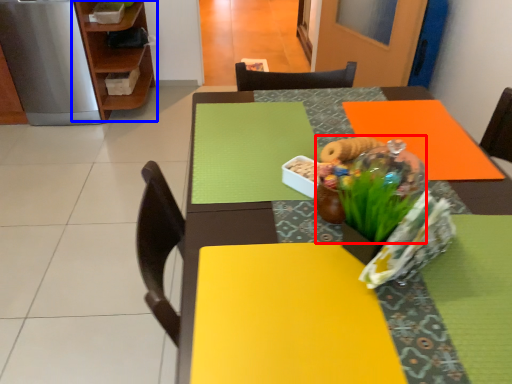
Question: Which object is further to the camera taking this photo, floral arrangement (highlighted by a red box) or shelf (highlighted by a blue box)?

Choices:
 (A) floral arrangement
 (B) shelf

Answer: (B)